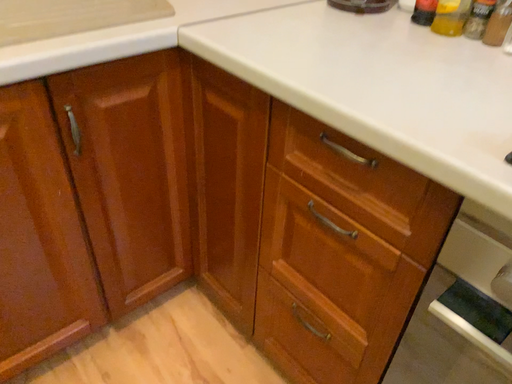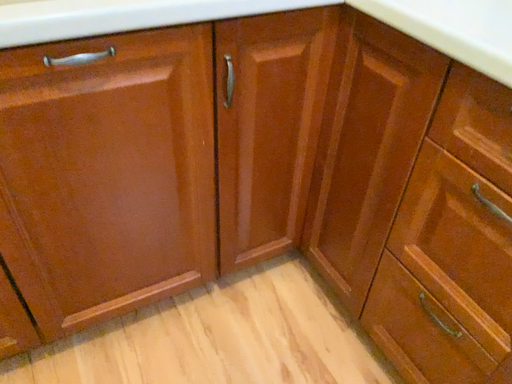
Question: How did the camera likely rotate when shooting the video?

Choices:
 (A) rotated right
 (B) rotated left

Answer: (B)